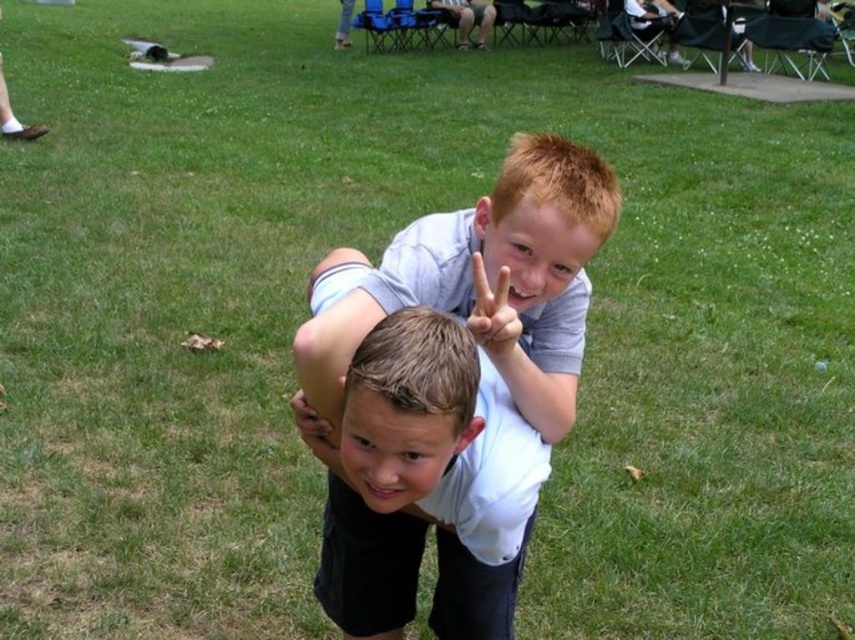
Looking at this image, who is taller, blonde hair at center or matte skin hand at upper center?

blonde hair at center is taller.

Is point (581, 166) closer to camera compared to point (494, 291)?

No, (581, 166) is behind (494, 291).

Who is more forward, (x=581, y=202) or (x=490, y=355)?

Point (x=490, y=355)

The image size is (855, 640). Identify the location of blonde hair at center. (544, 216).

Which is in front, point (453, 410) or point (488, 312)?

Point (453, 410) is in front.

Does point (358, 387) come behind point (508, 349)?

No, (358, 387) is in front of (508, 349).

Identify the location of light brown hair at center. Image resolution: width=855 pixels, height=640 pixels. (408, 406).

Which is above, light brown hair at center or blonde hair at center?

blonde hair at center is above.

Is light brown hair at center to the right of blonde hair at center from the viewer's perspective?

No, light brown hair at center is not to the right of blonde hair at center.

Is point (361, 358) positioned in front of point (568, 230)?

Yes, it is in front of point (568, 230).

Identify the location of light brown hair at center. (408, 406).